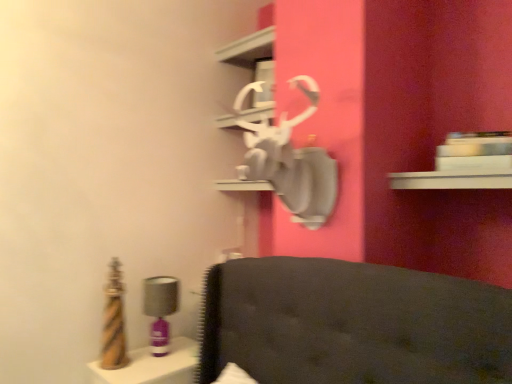
Question: Is matte purple table lamp at left taller than metallic gold vanity at lower left?

Choices:
 (A) no
 (B) yes

Answer: (B)

Question: Does matte purple table lamp at left come in front of metallic gold vanity at lower left?

Choices:
 (A) yes
 (B) no

Answer: (B)

Question: Is matte purple table lamp at left at the left side of metallic gold vanity at lower left?

Choices:
 (A) yes
 (B) no

Answer: (A)

Question: Would you say matte purple table lamp at left is a long distance from metallic gold vanity at lower left?

Choices:
 (A) yes
 (B) no

Answer: (B)

Question: From a real-world perspective, is matte purple table lamp at left positioned under metallic gold vanity at lower left based on gravity?

Choices:
 (A) yes
 (B) no

Answer: (B)

Question: Would you say white glossy shelf at upper center is to the left or to the right of metallic gold vanity at lower left in the picture?

Choices:
 (A) right
 (B) left

Answer: (A)

Question: From the image's perspective, is white glossy shelf at upper center above or below metallic gold vanity at lower left?

Choices:
 (A) below
 (B) above

Answer: (B)

Question: Do you think white glossy shelf at upper center is within metallic gold vanity at lower left, or outside of it?

Choices:
 (A) outside
 (B) inside

Answer: (A)

Question: In terms of width, does white glossy shelf at upper center look wider or thinner when compared to metallic gold vanity at lower left?

Choices:
 (A) thin
 (B) wide

Answer: (A)

Question: Looking at their shapes, would you say matte purple table lamp at left is wider or thinner than metallic gold vanity at lower left?

Choices:
 (A) thin
 (B) wide

Answer: (A)

Question: Looking at the image, does matte purple table lamp at left seem bigger or smaller compared to metallic gold vanity at lower left?

Choices:
 (A) small
 (B) big

Answer: (A)

Question: From a real-world perspective, relative to metallic gold vanity at lower left, is matte purple table lamp at left vertically above or below?

Choices:
 (A) below
 (B) above

Answer: (B)

Question: From the image's perspective, is matte purple table lamp at left located above or below metallic gold vanity at lower left?

Choices:
 (A) above
 (B) below

Answer: (A)

Question: Is white glossy shelf at upper center taller or shorter than matte purple table lamp at left?

Choices:
 (A) short
 (B) tall

Answer: (A)

Question: In terms of width, does white glossy shelf at upper center look wider or thinner when compared to matte purple table lamp at left?

Choices:
 (A) thin
 (B) wide

Answer: (B)